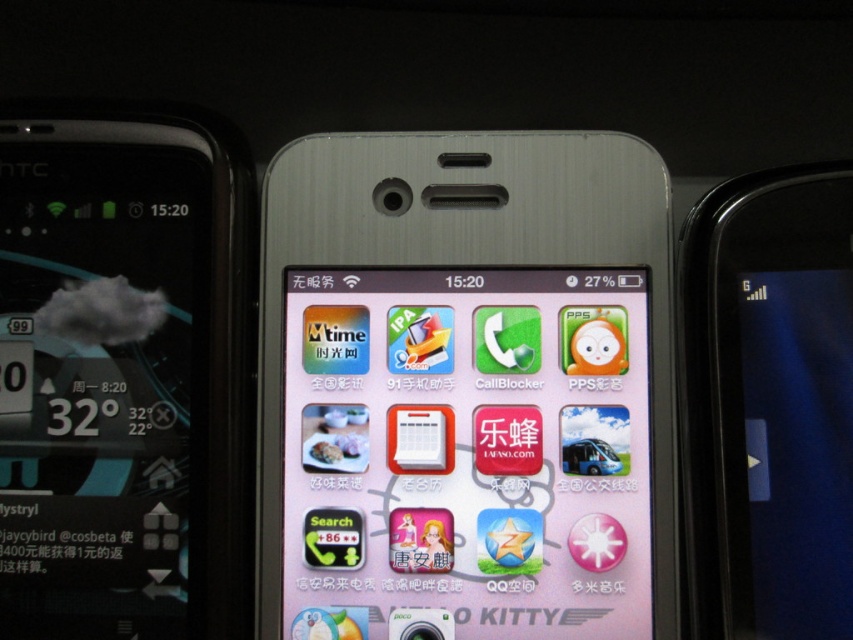
Question: Which point is farther to the camera?

Choices:
 (A) (404, 326)
 (B) (109, 554)
 (C) (693, 634)

Answer: (A)

Question: Does matte pink phone at center lie behind black glossy smartphone at right?

Choices:
 (A) no
 (B) yes

Answer: (B)

Question: Where is matte pink phone at center located in relation to black glossy smartphone at right in the image?

Choices:
 (A) below
 (B) above

Answer: (A)

Question: Is matte pink phone at center behind black glossy smartphone at right?

Choices:
 (A) no
 (B) yes

Answer: (B)

Question: Based on their relative distances, which object is nearer to the matte black smartphone at left?

Choices:
 (A) matte pink phone at center
 (B) black glossy smartphone at right

Answer: (A)

Question: Which point is closer to the camera taking this photo?

Choices:
 (A) (786, 508)
 (B) (54, 172)
 (C) (639, 272)

Answer: (A)